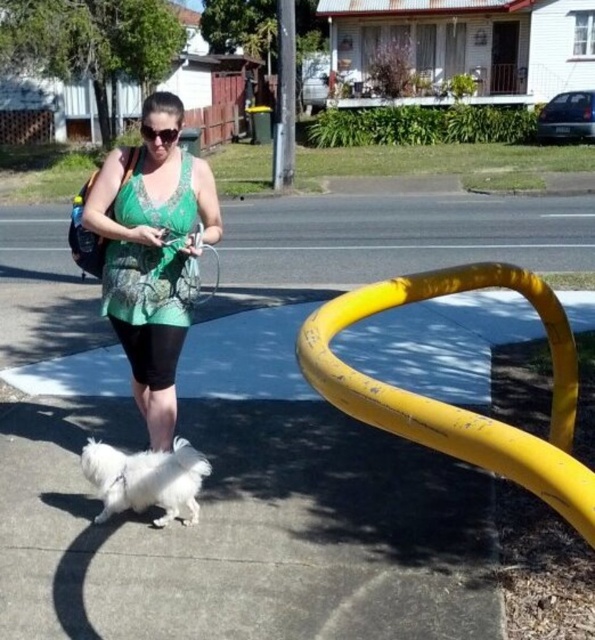
You are a delivery robot navigating the sidewalk. You see the yellow rubber pavement at center and the white fluffy dog at lower left. Which object is closer to your current position if you are facing the direction the woman is walking?

The white fluffy dog at lower left is closer to your current position because it is behind the yellow rubber pavement at center, which is in front of the dog.

You are a delivery person trying to deliver a package to the woman wearing the green lace dress at center. The white fluffy dog at lower left is blocking your path. Can you estimate whether you can walk around the dog without getting too close to it?

The green lace dress at center and white fluffy dog at lower left are 15.83 inches apart. Since the distance between them is about 15.83 inches, you can safely walk around the dog while maintaining a comfortable distance from both the woman and the dog.